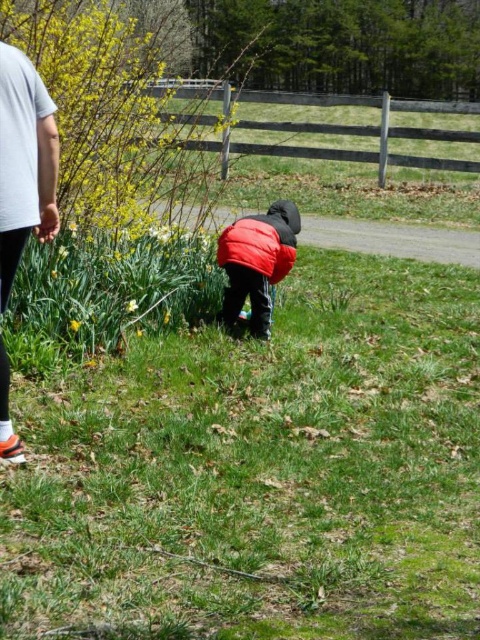
Is white cotton shirt at upper left to the left of matte red jacket at center from the viewer's perspective?

Yes, white cotton shirt at upper left is to the left of matte red jacket at center.

From the picture: Does white cotton shirt at upper left appear over matte red jacket at center?

Incorrect, white cotton shirt at upper left is not positioned above matte red jacket at center.

Does point (2, 284) lie behind point (254, 278)?

No.

Identify the location of white cotton shirt at upper left. The width and height of the screenshot is (480, 640). (24, 163).